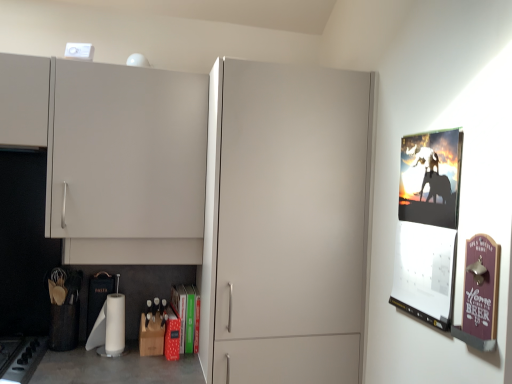
Question: Is white matte toilet paper at lower center positioned in front of matte white cabinet at upper left?

Choices:
 (A) no
 (B) yes

Answer: (A)

Question: Is white matte toilet paper at lower center aimed at matte white cabinet at upper left?

Choices:
 (A) no
 (B) yes

Answer: (A)

Question: Is white matte toilet paper at lower center bigger than matte white cabinet at upper left?

Choices:
 (A) yes
 (B) no

Answer: (B)

Question: Considering the relative sizes of white matte toilet paper at lower center and matte white cabinet at upper left in the image provided, is white matte toilet paper at lower center smaller than matte white cabinet at upper left?

Choices:
 (A) no
 (B) yes

Answer: (B)

Question: Considering the relative positions of white matte toilet paper at lower center and matte white cabinet at upper left in the image provided, is white matte toilet paper at lower center to the left of matte white cabinet at upper left from the viewer's perspective?

Choices:
 (A) yes
 (B) no

Answer: (B)

Question: Considering the relative sizes of white matte toilet paper at lower center and matte white cabinet at upper left in the image provided, is white matte toilet paper at lower center taller than matte white cabinet at upper left?

Choices:
 (A) no
 (B) yes

Answer: (A)

Question: Can you confirm if black matte gas stove at lower left is thinner than silhouette paper poster at right, acting as the second poster page starting from the front?

Choices:
 (A) no
 (B) yes

Answer: (A)

Question: Does black matte gas stove at lower left have a greater width compared to silhouette paper poster at right, positioned as the 1th poster page in back-to-front order?

Choices:
 (A) no
 (B) yes

Answer: (B)

Question: From a real-world perspective, does black matte gas stove at lower left stand above silhouette paper poster at right, positioned as the 1th poster page in back-to-front order?

Choices:
 (A) yes
 (B) no

Answer: (B)

Question: From the image's perspective, is black matte gas stove at lower left on top of silhouette paper poster at right, acting as the second poster page starting from the front?

Choices:
 (A) no
 (B) yes

Answer: (A)

Question: Is black matte gas stove at lower left to the left of silhouette paper poster at right, positioned as the 1th poster page in back-to-front order, from the viewer's perspective?

Choices:
 (A) no
 (B) yes

Answer: (B)

Question: Is black matte gas stove at lower left completely or partially outside of silhouette paper poster at right, positioned as the 1th poster page in back-to-front order?

Choices:
 (A) no
 (B) yes

Answer: (B)

Question: Can you confirm if white matte toilet paper at lower center is wider than green matte book at lower center?

Choices:
 (A) no
 (B) yes

Answer: (A)